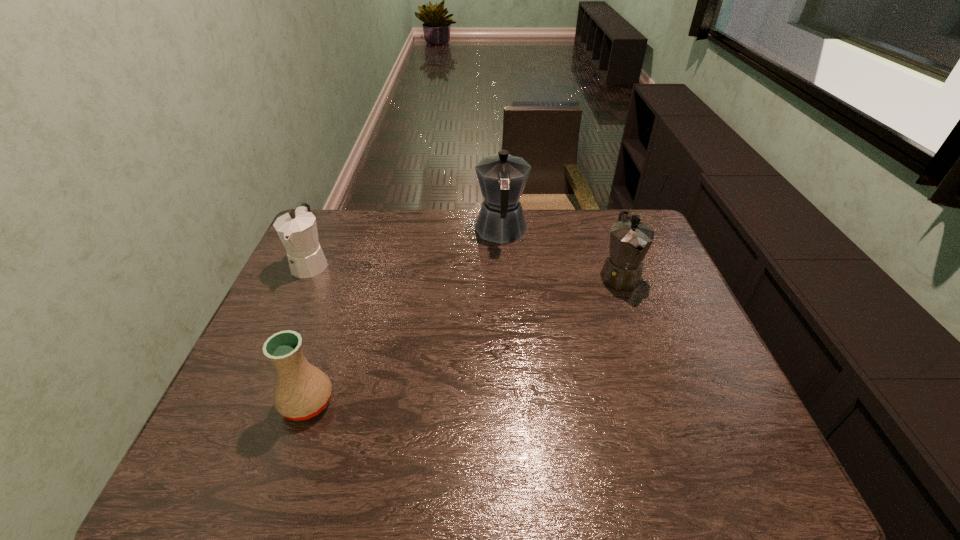
This screenshot has height=540, width=960. Find the location of `free space between the tallest object and the rightmost object`. free space between the tallest object and the rightmost object is located at coordinates (560, 253).

Where is `free space between the second object from left to right and the leftmost object`? The height and width of the screenshot is (540, 960). free space between the second object from left to right and the leftmost object is located at coordinates (309, 333).

At what (x,y) coordinates should I click in order to perform the action: click on free space between the leftmost coffeepot and the rightmost coffeepot. Please return your answer as a coordinate pair (x, y). Looking at the image, I should click on (465, 269).

You are a GUI agent. You are given a task and a screenshot of the screen. Output one action in this format:
    pyautogui.click(x=<x>, y=<y>)
    Task: Click on the empty location between the third object from left to right and the nearest object
    
    Given the screenshot: What is the action you would take?
    pyautogui.click(x=404, y=316)

You are a GUI agent. You are given a task and a screenshot of the screen. Output one action in this format:
    pyautogui.click(x=<x>, y=<y>)
    Task: Click on the vacant area that lies between the rightmost object and the third object from left to right
    
    Given the screenshot: What is the action you would take?
    pyautogui.click(x=560, y=253)

Where is `free spot between the rightmost object and the nearest object`? The image size is (960, 540). free spot between the rightmost object and the nearest object is located at coordinates (464, 339).

Locate an element on the screen. empty location between the tallest coffeepot and the third object from right to left is located at coordinates (404, 316).

Locate an element on the screen. This screenshot has width=960, height=540. vacant point located between the leftmost object and the pottery is located at coordinates (309, 333).

Point out which object is positioned as the third nearest to the nearest object. Please provide its 2D coordinates. Your answer should be formatted as a tuple, i.e. [(x, y)], where the tuple contains the x and y coordinates of a point satisfying the conditions above.

[(630, 239)]

Locate which object ranks third in proximity to the second object from left to right. Please provide its 2D coordinates. Your answer should be formatted as a tuple, i.e. [(x, y)], where the tuple contains the x and y coordinates of a point satisfying the conditions above.

[(630, 239)]